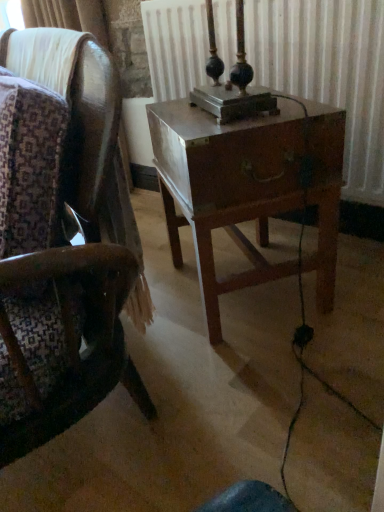
Question: Can you confirm if wooden nightstand at center is smaller than metallic radiator at center?

Choices:
 (A) no
 (B) yes

Answer: (B)

Question: Is wooden nightstand at center not near metallic radiator at center?

Choices:
 (A) no
 (B) yes

Answer: (A)

Question: Is wooden nightstand at center taller than metallic radiator at center?

Choices:
 (A) yes
 (B) no

Answer: (A)

Question: From a real-world perspective, is wooden nightstand at center physically below metallic radiator at center?

Choices:
 (A) no
 (B) yes

Answer: (B)

Question: From the image's perspective, is wooden nightstand at center under metallic radiator at center?

Choices:
 (A) no
 (B) yes

Answer: (B)

Question: In the image, is wooden nightstand at center on the left side or the right side of metallic radiator at center?

Choices:
 (A) right
 (B) left

Answer: (B)

Question: From the image's perspective, relative to metallic radiator at center, is wooden nightstand at center above or below?

Choices:
 (A) above
 (B) below

Answer: (B)

Question: Does point (244, 166) appear closer or farther from the camera than point (228, 17)?

Choices:
 (A) farther
 (B) closer

Answer: (B)

Question: In the image, is wooden nightstand at center positioned in front of or behind metallic radiator at center?

Choices:
 (A) behind
 (B) front

Answer: (B)

Question: In the image, is metallic radiator at center on the left side or the right side of wooden nightstand at center?

Choices:
 (A) right
 (B) left

Answer: (A)

Question: Is metallic radiator at center inside or outside of wooden nightstand at center?

Choices:
 (A) outside
 (B) inside

Answer: (A)

Question: In terms of width, does metallic radiator at center look wider or thinner when compared to wooden nightstand at center?

Choices:
 (A) wide
 (B) thin

Answer: (B)

Question: From the image's perspective, is metallic radiator at center positioned above or below wooden nightstand at center?

Choices:
 (A) above
 (B) below

Answer: (A)

Question: Based on their positions, is metallic radiator at center located to the left or right of wooden chair at center?

Choices:
 (A) left
 (B) right

Answer: (B)

Question: Looking at the image, does metallic radiator at center seem bigger or smaller compared to wooden chair at center?

Choices:
 (A) small
 (B) big

Answer: (A)